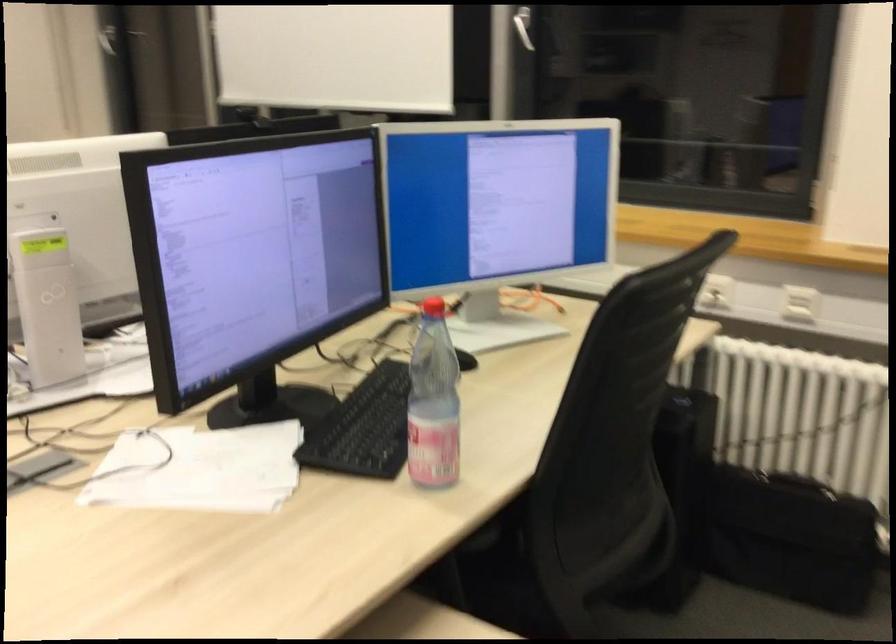
Locate an element on the screen. orange eyeglasses is located at coordinates [x=495, y=214].